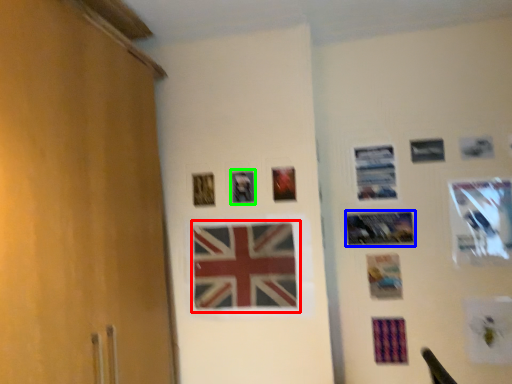
Question: Based on their relative distances, which object is farther from flag (highlighted by a red box)? Choose from picture frame (highlighted by a blue box) and picture frame (highlighted by a green box).

Choices:
 (A) picture frame
 (B) picture frame

Answer: (A)